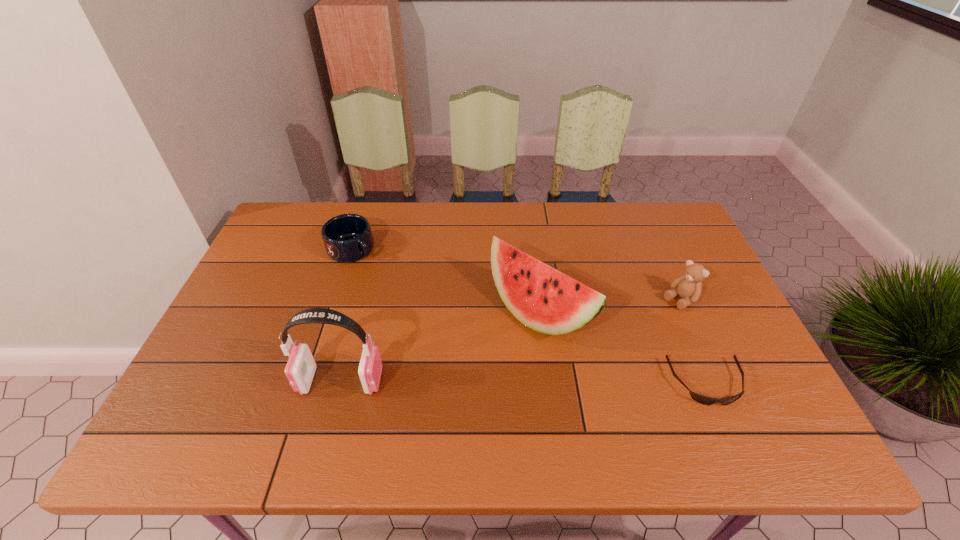
Identify the location of vacant space that's between the teddy bear and the sunglasses. (693, 342).

The width and height of the screenshot is (960, 540). What are the coordinates of `free space between the watermelon and the tallest object` in the screenshot? It's located at (440, 347).

At what (x,y) coordinates should I click in order to perform the action: click on unoccupied area between the earphone and the third shortest object. Please return your answer as a coordinate pair (x, y). Image resolution: width=960 pixels, height=540 pixels. Looking at the image, I should click on (510, 341).

Find the location of a particular element. Image resolution: width=960 pixels, height=540 pixels. free space between the third object from left to right and the mug is located at coordinates (445, 281).

You are a GUI agent. You are given a task and a screenshot of the screen. Output one action in this format:
    pyautogui.click(x=<x>, y=<y>)
    Task: Click on the vacant area that lies between the watermelon and the earphone
    The image size is (960, 540).
    Given the screenshot: What is the action you would take?
    pyautogui.click(x=440, y=347)

Where is `vacant area between the earphone and the third tallest object`? The image size is (960, 540). vacant area between the earphone and the third tallest object is located at coordinates (510, 341).

Where is `vacant space that is in between the second shortest object and the third object from left to right`? The height and width of the screenshot is (540, 960). vacant space that is in between the second shortest object and the third object from left to right is located at coordinates (445, 281).

Where is `object that is the fourth closest to the second tallest object`? object that is the fourth closest to the second tallest object is located at coordinates (347, 238).

Find the location of a particular element. The width and height of the screenshot is (960, 540). object that can be found as the closest to the sunglasses is located at coordinates (688, 286).

What are the coordinates of `vacant point that satisfies the following two spatial constraints: 1. on the back side of the third shortest object; 2. on the right side of the watermelon` in the screenshot? It's located at (538, 300).